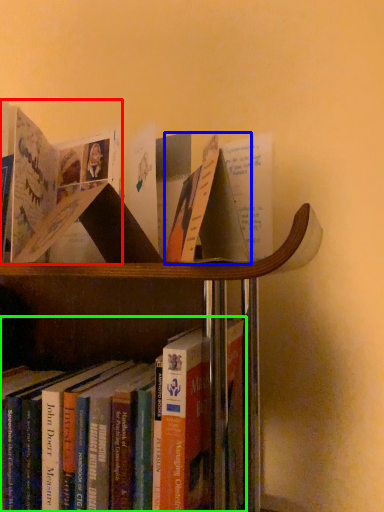
Question: Which is farther away from book (highlighted by a red box)? paperback book (highlighted by a blue box) or book (highlighted by a green box)?

Choices:
 (A) paperback book
 (B) book

Answer: (B)